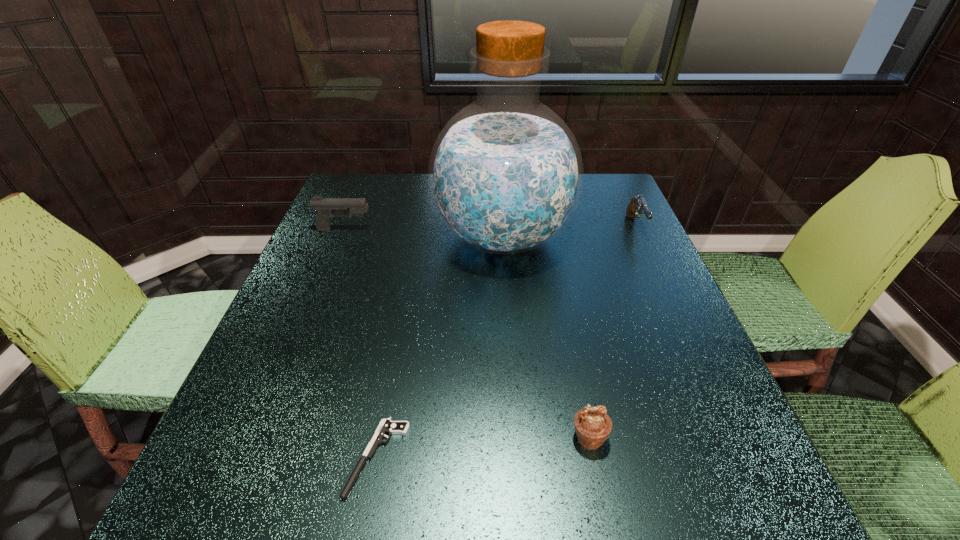
I want to click on vacant space that satisfies the following two spatial constraints: 1. at the barrel of the leftmost pistol; 2. on the back side of the muffin, so click(261, 438).

You are a GUI agent. You are given a task and a screenshot of the screen. Output one action in this format:
    pyautogui.click(x=<x>, y=<y>)
    Task: Click on the free space that satisfies the following two spatial constraints: 1. on the front side of the tallest object; 2. on the front-facing side of the nearest pistol
    This screenshot has height=540, width=960.
    Given the screenshot: What is the action you would take?
    pyautogui.click(x=517, y=457)

Where is `free spot that satisfies the following two spatial constraints: 1. at the barrel of the rightmost pistol; 2. on the front-facing side of the shortest pistol`? free spot that satisfies the following two spatial constraints: 1. at the barrel of the rightmost pistol; 2. on the front-facing side of the shortest pistol is located at coordinates (742, 457).